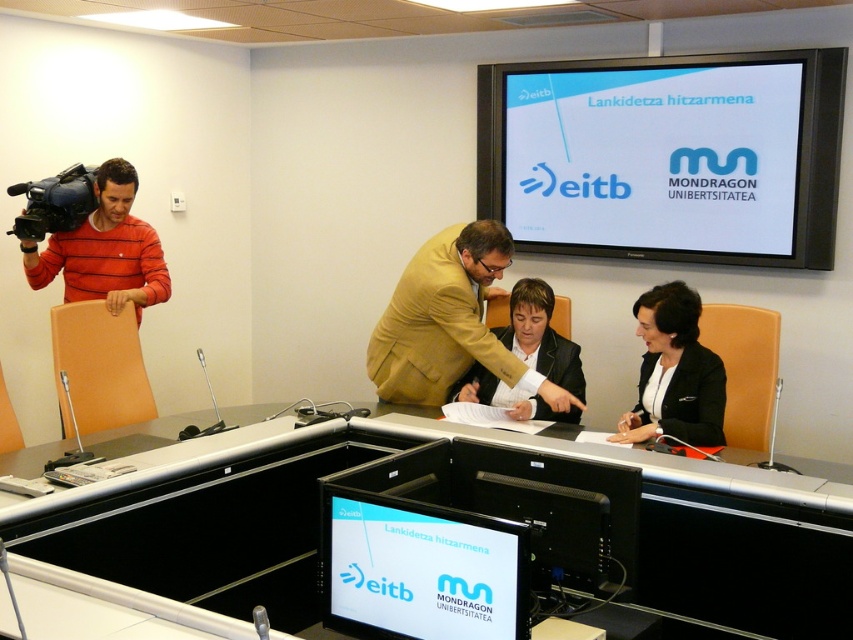
You are an event organizer who needs to set up a projector for the presentation. The projector can only project onto surfaces larger than the striped cotton shirt at left. Will the white glossy projection screen at upper center work as the projection surface?

The white glossy projection screen at upper center has a larger size compared to the striped cotton shirt at left, so it will work as the projection surface since it is larger than the required minimum size.

You are a technician setting up equipment for a press conference. You have a white glossy projection screen at upper center and a camera that needs to be placed. The camera has a focal length that requires it to be at least 10 feet away from the screen to capture the entire screen in frame. Based on the scene description, can the camera be positioned as required?

The white glossy projection screen at upper center and camera are 11.71 feet apart, which is more than the required 10 feet. Therefore, the camera can be positioned as required to capture the entire screen in frame.

Based on the photo, what object is located at the point with coordinates (450, 323) in the image?

The point (450, 323) is located on the matte gold suit at center.